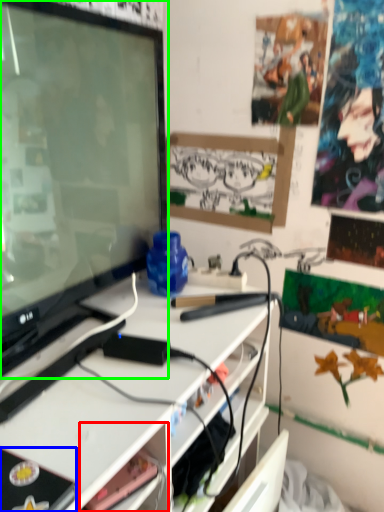
Question: Which object is the closest to the shelf (highlighted by a red box)? Choose among these: equipment (highlighted by a blue box) or television (highlighted by a green box).

Choices:
 (A) equipment
 (B) television

Answer: (A)